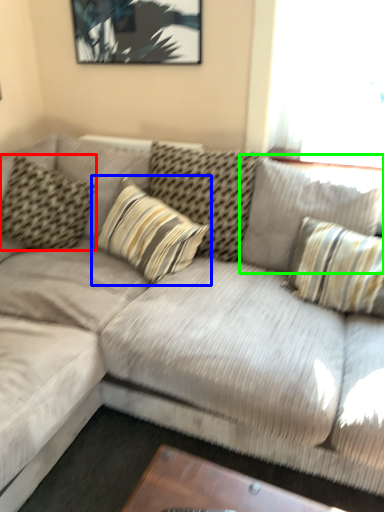
Question: Which object is positioned farthest from pillow (highlighted by a red box)? Select from pillow (highlighted by a blue box) and pillow (highlighted by a green box).

Choices:
 (A) pillow
 (B) pillow

Answer: (B)